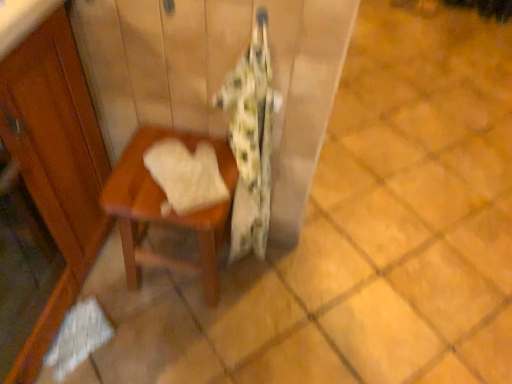
I want to click on empty space that is to the right of fluffy white blanket at center, so click(289, 276).